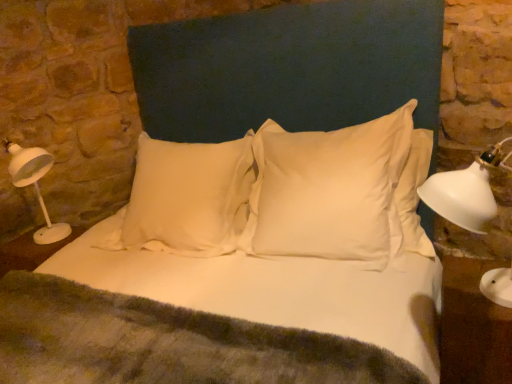
Question: Can you confirm if white satin pillow at center, marked as the second pillow in a right-to-left arrangement, is positioned to the left of white fabric headboard at center?

Choices:
 (A) yes
 (B) no

Answer: (A)

Question: Is white satin pillow at center, positioned as the first pillow in left-to-right order, in contact with white fabric headboard at center?

Choices:
 (A) yes
 (B) no

Answer: (B)

Question: Is white satin pillow at center, marked as the second pillow in a right-to-left arrangement, aimed at white fabric headboard at center?

Choices:
 (A) no
 (B) yes

Answer: (A)

Question: Considering the relative positions of white satin pillow at center, marked as the second pillow in a right-to-left arrangement, and white fabric headboard at center in the image provided, is white satin pillow at center, marked as the second pillow in a right-to-left arrangement, in front of white fabric headboard at center?

Choices:
 (A) yes
 (B) no

Answer: (B)

Question: Can you confirm if white satin pillow at center, positioned as the first pillow in left-to-right order, is taller than white fabric headboard at center?

Choices:
 (A) yes
 (B) no

Answer: (B)

Question: Does white satin pillow at center, marked as the second pillow in a right-to-left arrangement, have a lesser width compared to white fabric headboard at center?

Choices:
 (A) no
 (B) yes

Answer: (B)

Question: From the image's perspective, would you say white satin pillow at center, marked as the second pillow in a right-to-left arrangement, is shown under white plastic table lamp at left?

Choices:
 (A) yes
 (B) no

Answer: (A)

Question: Considering the relative sizes of white satin pillow at center, marked as the second pillow in a right-to-left arrangement, and white plastic table lamp at left in the image provided, is white satin pillow at center, marked as the second pillow in a right-to-left arrangement, thinner than white plastic table lamp at left?

Choices:
 (A) no
 (B) yes

Answer: (B)

Question: From a real-world perspective, does white satin pillow at center, positioned as the first pillow in left-to-right order, sit lower than white plastic table lamp at left?

Choices:
 (A) yes
 (B) no

Answer: (A)

Question: Would you say white plastic table lamp at left is part of white satin pillow at center, marked as the second pillow in a right-to-left arrangement,'s contents?

Choices:
 (A) yes
 (B) no

Answer: (B)

Question: Is white satin pillow at center, positioned as the first pillow in left-to-right order, next to white plastic table lamp at left?

Choices:
 (A) yes
 (B) no

Answer: (B)

Question: Can you confirm if white satin pillow at center, positioned as the first pillow in left-to-right order, is bigger than white plastic table lamp at left?

Choices:
 (A) yes
 (B) no

Answer: (A)

Question: Is white plastic table lamp at left further to the viewer compared to white smooth pillow at center, the second pillow viewed from the left?

Choices:
 (A) no
 (B) yes

Answer: (B)